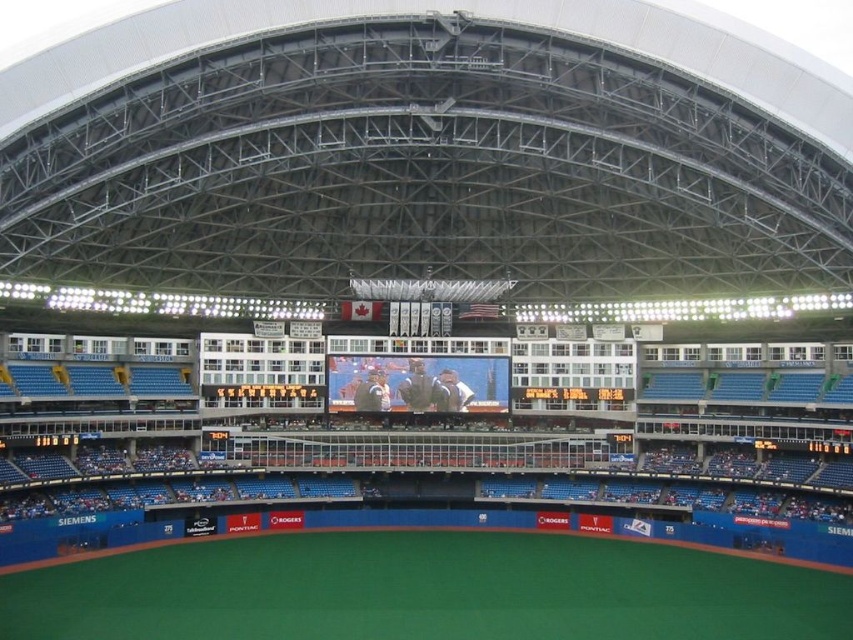
Does matte digital screen at center appear under black glossy scoreboard at center?

Actually, matte digital screen at center is above black glossy scoreboard at center.

Between point (357, 371) and point (213, 387), which one is positioned in front?

Point (213, 387) is in front.

Locate an element on the screen. The height and width of the screenshot is (640, 853). matte digital screen at center is located at coordinates (416, 381).